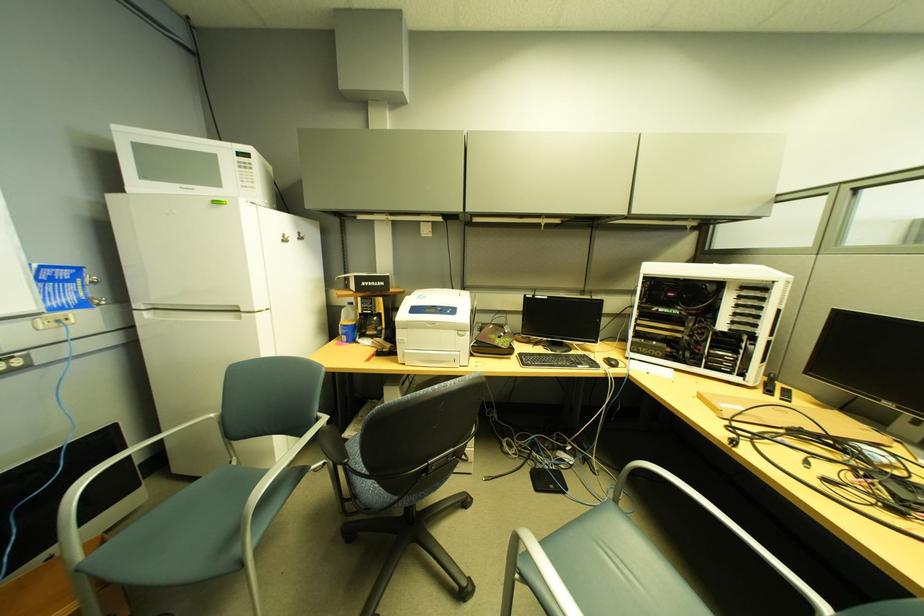
This screenshot has height=616, width=924. What are the coordinates of `black chair sitting surface` in the screenshot? It's located at (610, 569).